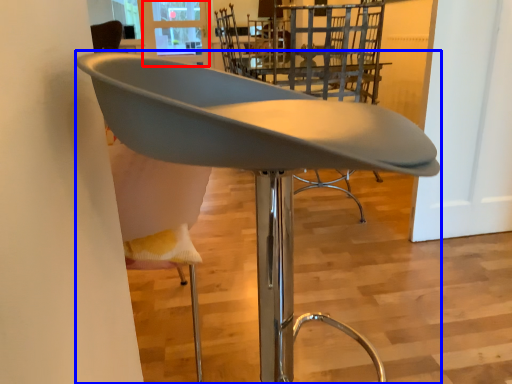
Question: Among these objects, which one is nearest to the camera, window screen (highlighted by a red box) or chair (highlighted by a blue box)?

Choices:
 (A) window screen
 (B) chair

Answer: (B)